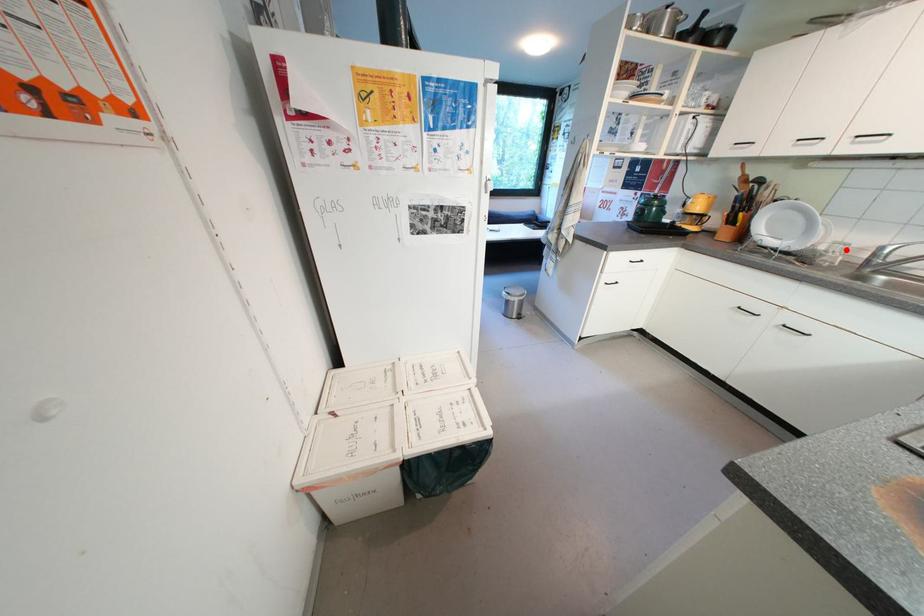
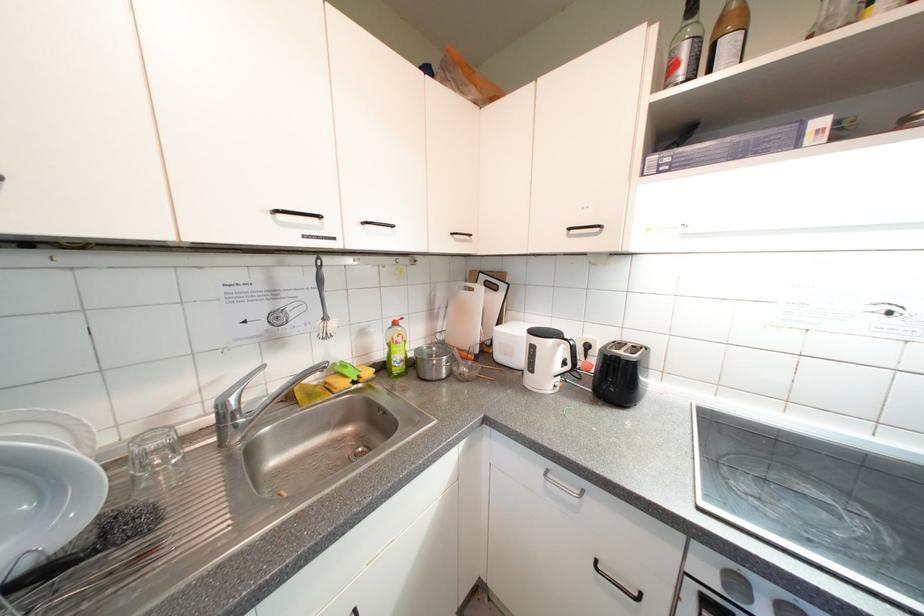
Where in the second image is the point corresponding to the highlighted location from the first image?

(162, 447)